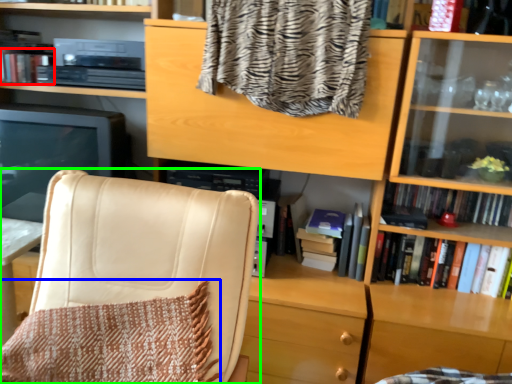
Question: Which object is the closest to the book (highlighted by a red box)? Choose among these: blanket (highlighted by a blue box) or chair (highlighted by a green box).

Choices:
 (A) blanket
 (B) chair

Answer: (B)